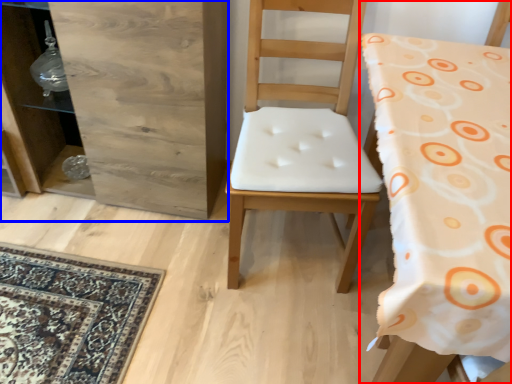
Question: Which object appears farthest to the camera in this image, chair (highlighted by a red box) or dresser (highlighted by a blue box)?

Choices:
 (A) chair
 (B) dresser

Answer: (B)